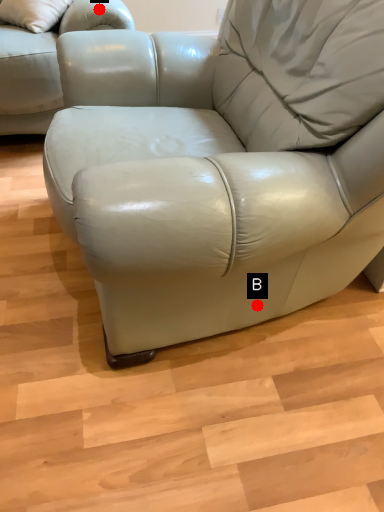
Question: Two points are circled on the image, labeled by A and B beside each circle. Which point is further to the camera?

Choices:
 (A) A is further
 (B) B is further

Answer: (A)